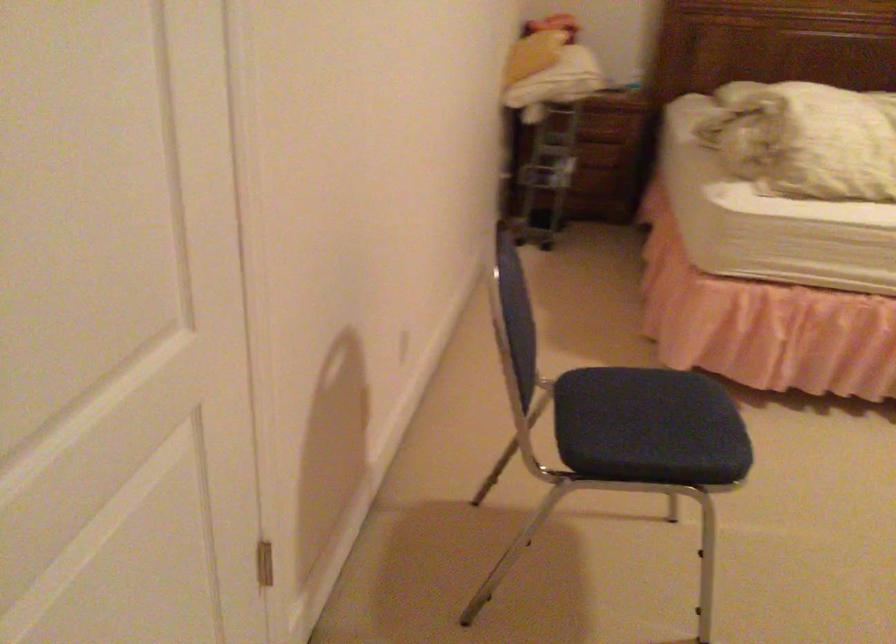
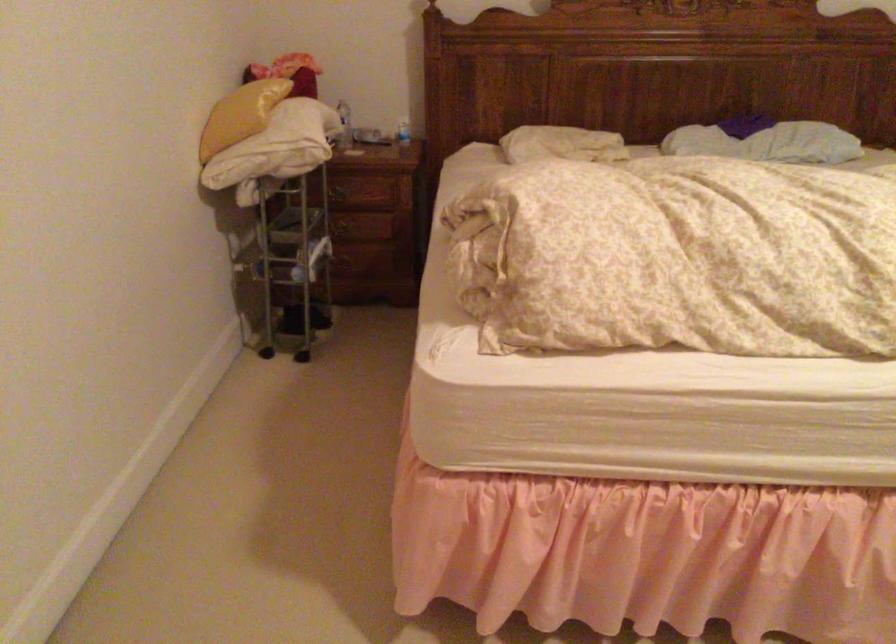
The point at (565, 109) is marked in the first image. Where is the corresponding point in the second image?

(338, 194)